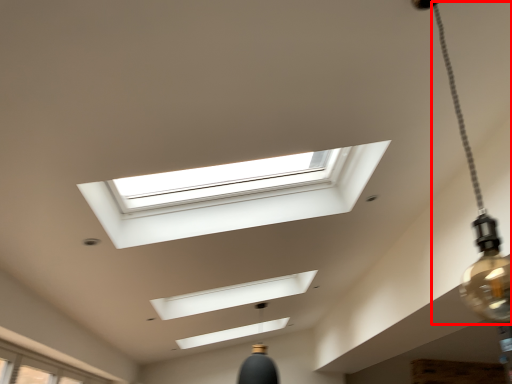
Question: From the image's perspective, where is lamp (annotated by the red box) located in relation to window in the image?

Choices:
 (A) above
 (B) below

Answer: (A)